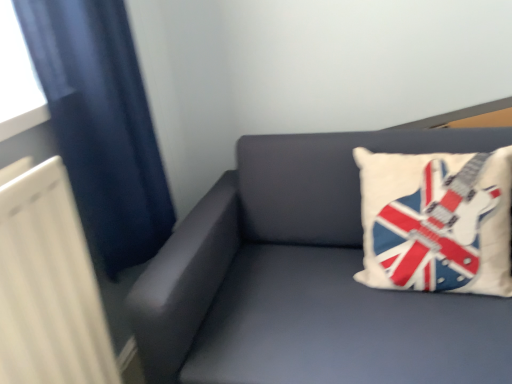
Question: From a real-world perspective, is matte gray couch at upper right positioned above or below dark blue fabric at left?

Choices:
 (A) below
 (B) above

Answer: (A)

Question: Is point (209, 190) positioned closer to the camera than point (142, 243)?

Choices:
 (A) closer
 (B) farther

Answer: (B)

Question: Estimate the real-world distances between objects in this image. Which object is farther from the white fabric pillow with guitar design at upper right?

Choices:
 (A) matte gray couch at upper right
 (B) dark blue fabric at left

Answer: (B)

Question: Which object is positioned farthest from the white fabric pillow with guitar design at upper right?

Choices:
 (A) dark blue fabric at left
 (B) matte gray couch at upper right

Answer: (A)